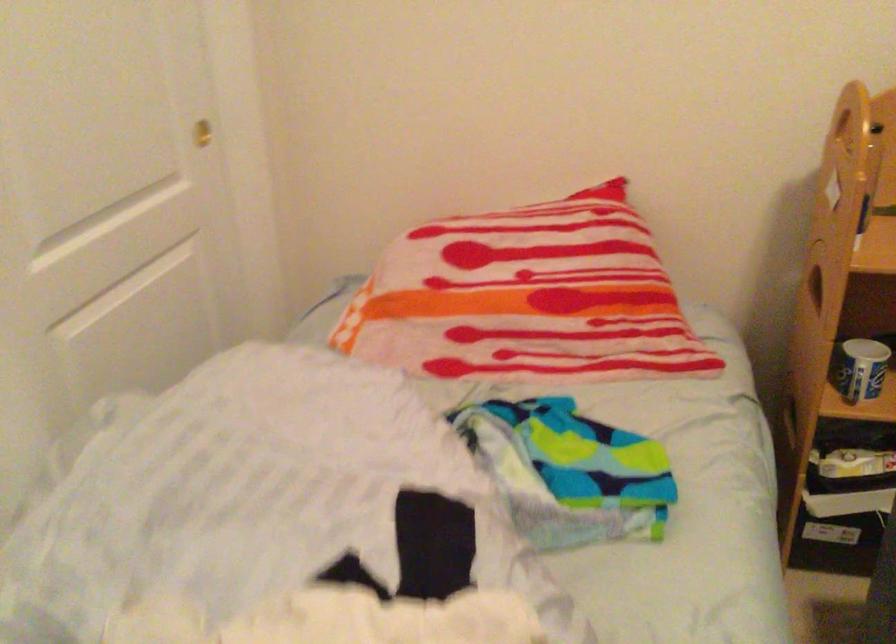
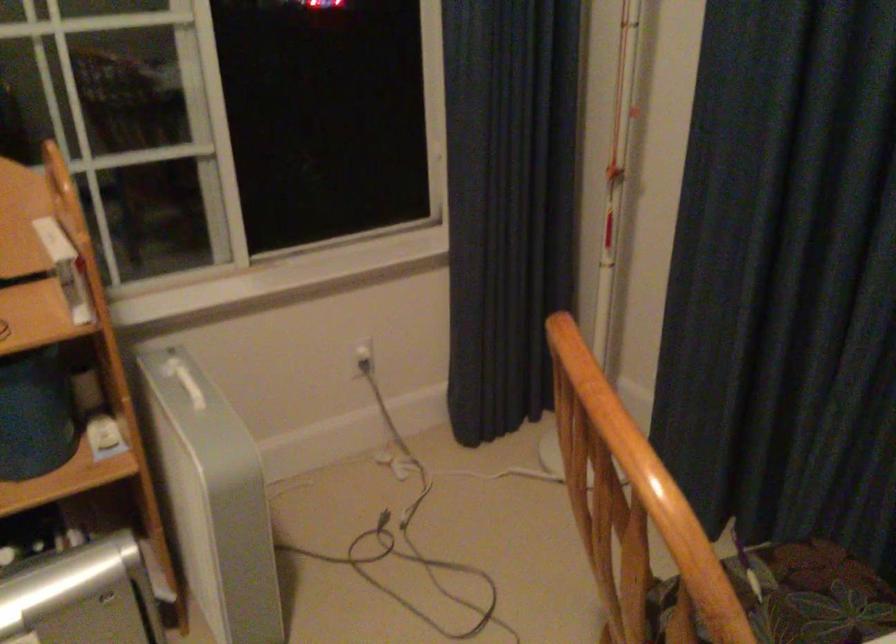
Question: The camera is either moving clockwise (left) or counter-clockwise (right) around the object. The first image is from the beginning of the video and the second image is from the end. Is the camera moving left or right when shooting the video?

Choices:
 (A) Left
 (B) Right

Answer: (A)